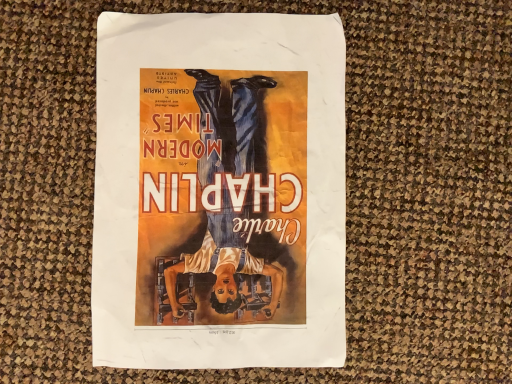
Where is `free space above matte paper poster at center (from a real-world perspective)`? The width and height of the screenshot is (512, 384). free space above matte paper poster at center (from a real-world perspective) is located at coordinates (215, 197).